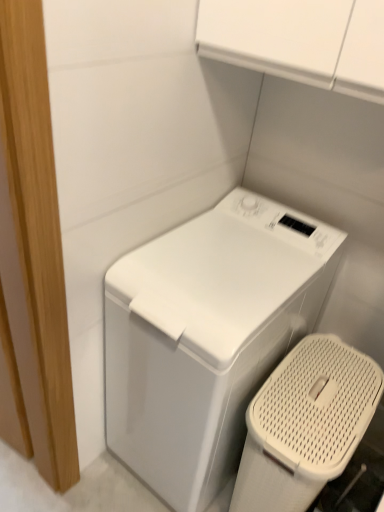
Question: Can you confirm if white mesh laundry basket at lower right is positioned to the right of white glossy washing machine at center?

Choices:
 (A) yes
 (B) no

Answer: (A)

Question: From a real-world perspective, is white mesh laundry basket at lower right located beneath white glossy washing machine at center?

Choices:
 (A) yes
 (B) no

Answer: (A)

Question: Considering the relative sizes of white mesh laundry basket at lower right and white glossy washing machine at center in the image provided, is white mesh laundry basket at lower right thinner than white glossy washing machine at center?

Choices:
 (A) yes
 (B) no

Answer: (A)

Question: From the image's perspective, would you say white mesh laundry basket at lower right is shown under white glossy washing machine at center?

Choices:
 (A) yes
 (B) no

Answer: (A)

Question: Is white mesh laundry basket at lower right oriented towards white glossy washing machine at center?

Choices:
 (A) yes
 (B) no

Answer: (B)

Question: Is white glossy washing machine at center at the back of white mesh laundry basket at lower right?

Choices:
 (A) yes
 (B) no

Answer: (B)

Question: Does white glossy washing machine at center have a greater height compared to white mesh laundry basket at lower right?

Choices:
 (A) yes
 (B) no

Answer: (A)

Question: From the image's perspective, is white glossy washing machine at center on top of white mesh laundry basket at lower right?

Choices:
 (A) no
 (B) yes

Answer: (B)

Question: Considering the relative sizes of white glossy washing machine at center and white mesh laundry basket at lower right in the image provided, is white glossy washing machine at center wider than white mesh laundry basket at lower right?

Choices:
 (A) yes
 (B) no

Answer: (A)

Question: Is white glossy washing machine at center outside white mesh laundry basket at lower right?

Choices:
 (A) yes
 (B) no

Answer: (A)

Question: From a real-world perspective, is white glossy washing machine at center positioned over white mesh laundry basket at lower right based on gravity?

Choices:
 (A) no
 (B) yes

Answer: (B)

Question: Does white glossy washing machine at center turn towards white mesh laundry basket at lower right?

Choices:
 (A) yes
 (B) no

Answer: (B)

Question: Based on their sizes in the image, would you say white glossy washing machine at center is bigger or smaller than white mesh laundry basket at lower right?

Choices:
 (A) small
 (B) big

Answer: (B)